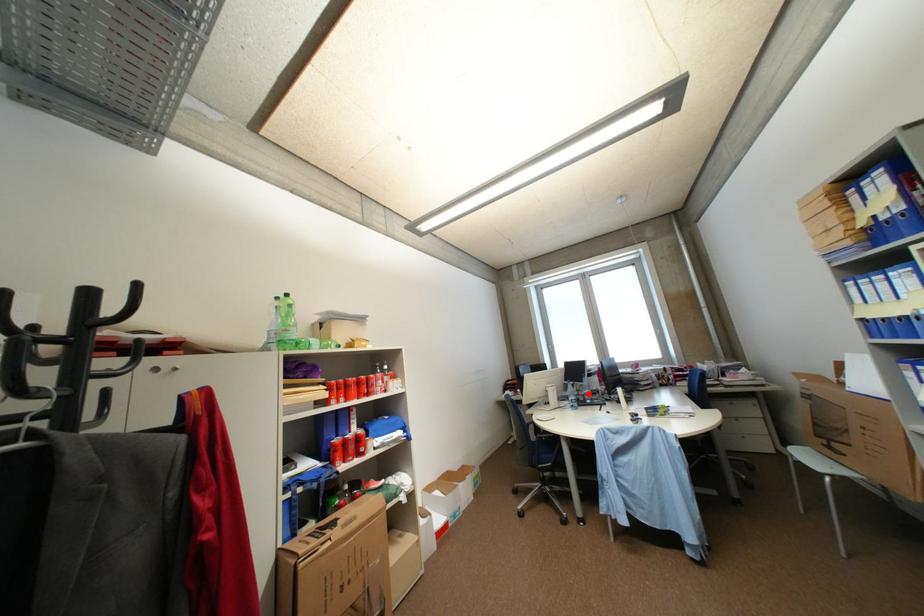
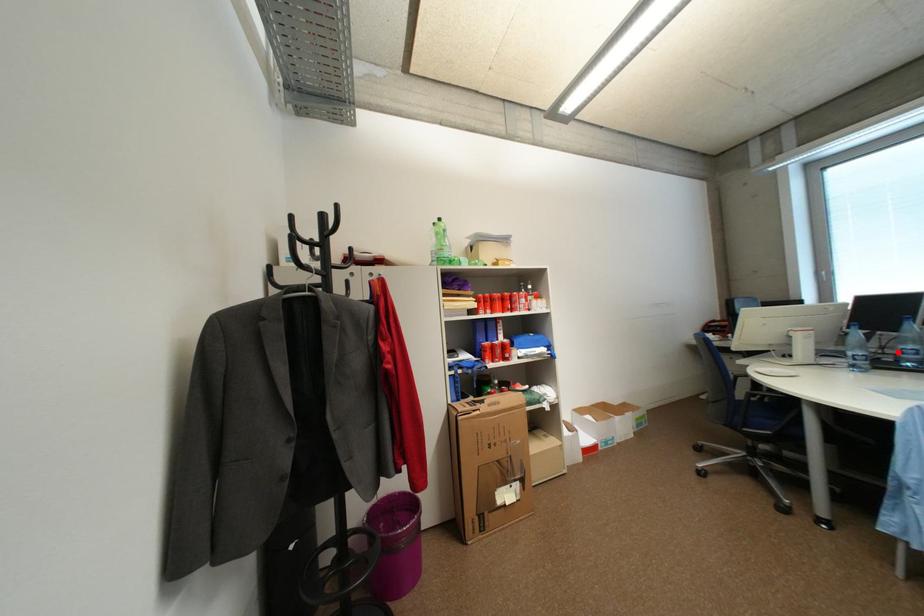
I am providing you with two images of the same scene from different viewpoints. A red point is marked on the first image and another point is marked on the second image. Is the red point in image1 aligned with the point shown in image2?

Yes